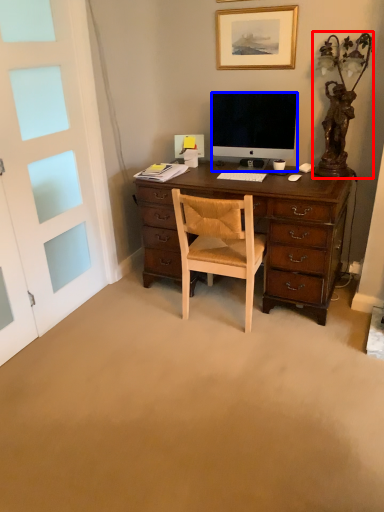
Question: Among these objects, which one is nearest to the camera, table lamp (highlighted by a red box) or television (highlighted by a blue box)?

Choices:
 (A) table lamp
 (B) television

Answer: (A)